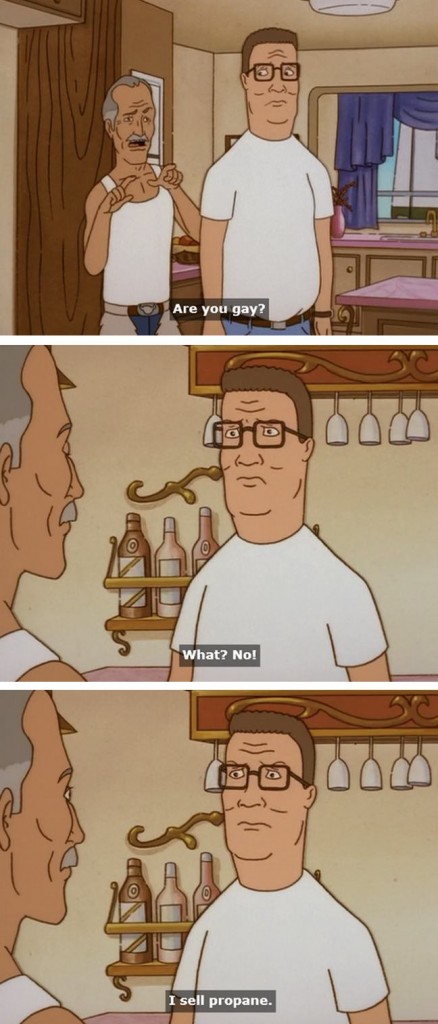
Where is `bottle`? Image resolution: width=438 pixels, height=1024 pixels. bottle is located at coordinates (138, 893), (163, 896), (199, 888), (130, 531), (167, 543), (210, 540).